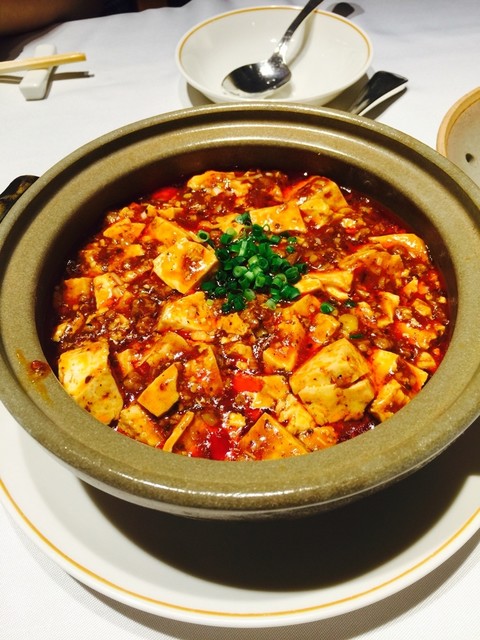
I want to click on silverware, so click(x=376, y=80).